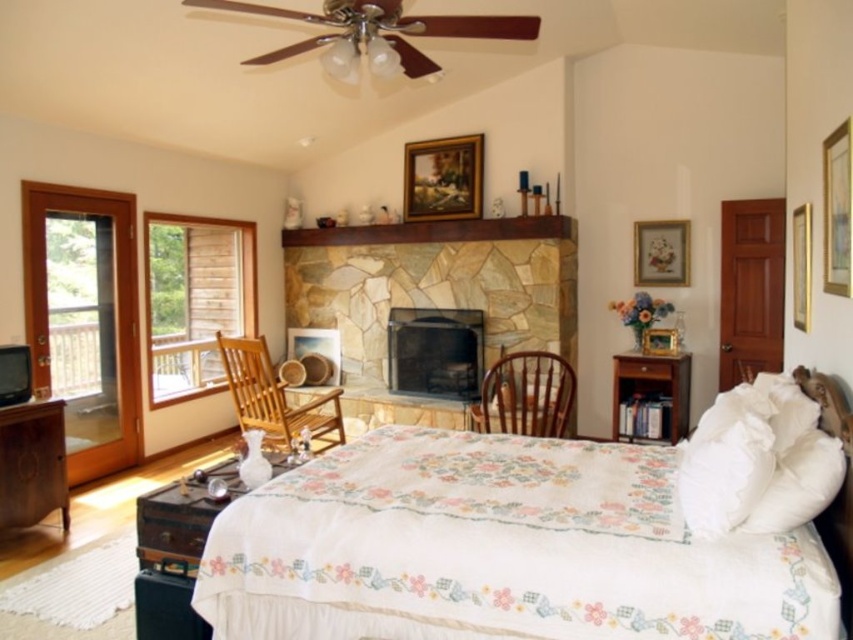
You are standing at the entrance of the bedroom and see the white quilt with floral patterns and the point marked at coordinate (798,484). Where is the point located relative to the white quilt?

The point at coordinate (798,484) is located at the right side of the white quilt, as it corresponds to the white fluffy pillow at right.

You are standing in the bedroom and want to place a new painting on the wall. You have a large painting that is 1.2 meters wide. The space between the wooden dresser at lower left and the matte gold picture frame at upper right is 1.5 meters. Can you fit the painting in that space?

The space between the wooden dresser at lower left and the matte gold picture frame at upper right is 1.5 meters, which is wider than the painting that is 1.2 meters wide. Therefore, the painting can be placed there.